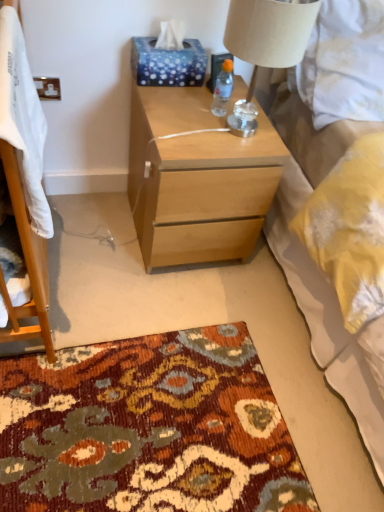
At what (x,y) coordinates should I click in order to perform the action: click on vacant space in between beige fabric lampshade at upper right and blue dotted tissue at upper center. Please return your answer as a coordinate pair (x, y). The height and width of the screenshot is (512, 384). Looking at the image, I should click on click(x=185, y=103).